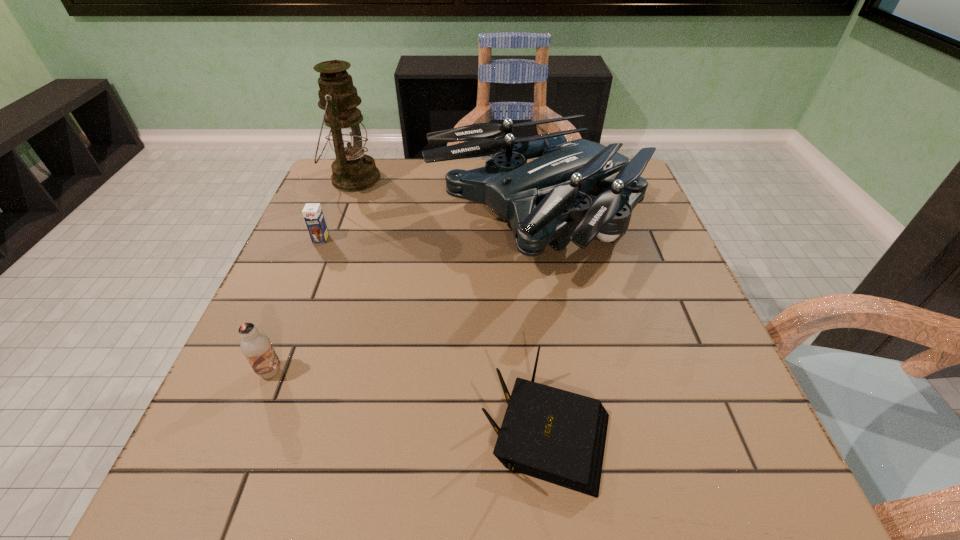
This screenshot has height=540, width=960. I want to click on the tallest object, so click(352, 171).

You are a GUI agent. You are given a task and a screenshot of the screen. Output one action in this format:
    pyautogui.click(x=<x>, y=<y>)
    Task: Click on the drone
    
    Given the screenshot: What is the action you would take?
    pyautogui.click(x=546, y=200)

Identify the location of the taller chocolate milk. Image resolution: width=960 pixels, height=540 pixels. (256, 346).

Where is `the nearer chocolate milk`? the nearer chocolate milk is located at coordinates (256, 346).

This screenshot has width=960, height=540. What are the coordinates of `the shorter chocolate milk` in the screenshot? It's located at (312, 212).

This screenshot has width=960, height=540. I want to click on router, so click(x=557, y=436).

At what (x,y) coordinates should I click in order to perform the action: click on free space located 0.200m on the right of the oil lamp. Please return your answer as a coordinate pair (x, y). This screenshot has height=540, width=960. Looking at the image, I should click on (449, 179).

The height and width of the screenshot is (540, 960). Find the location of `free space located on the front of the fourth shortest object`. free space located on the front of the fourth shortest object is located at coordinates (554, 341).

Identify the location of free space located on the back of the third tallest object. (302, 292).

Where is `free space located on the front label of the farther chocolate milk`? The width and height of the screenshot is (960, 540). free space located on the front label of the farther chocolate milk is located at coordinates (302, 284).